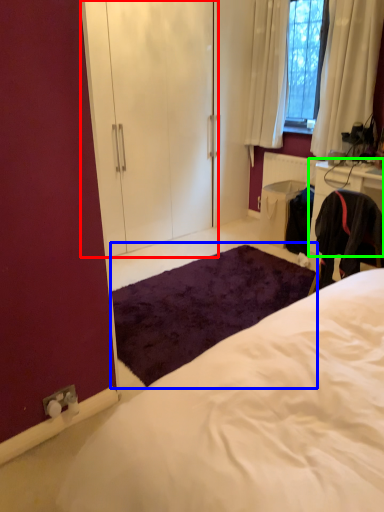
Question: Considering the real-world distances, which object is farthest from armoire (highlighted by a red box)? mat (highlighted by a blue box) or cabinetry (highlighted by a green box)?

Choices:
 (A) mat
 (B) cabinetry

Answer: (B)